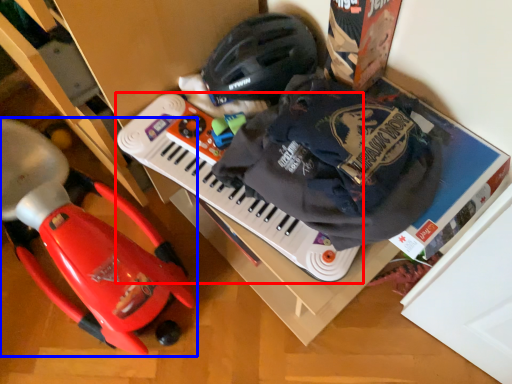
Question: Which object appears farthest to the camera in this image, musical keyboard (highlighted by a red box) or toy (highlighted by a blue box)?

Choices:
 (A) musical keyboard
 (B) toy

Answer: (A)